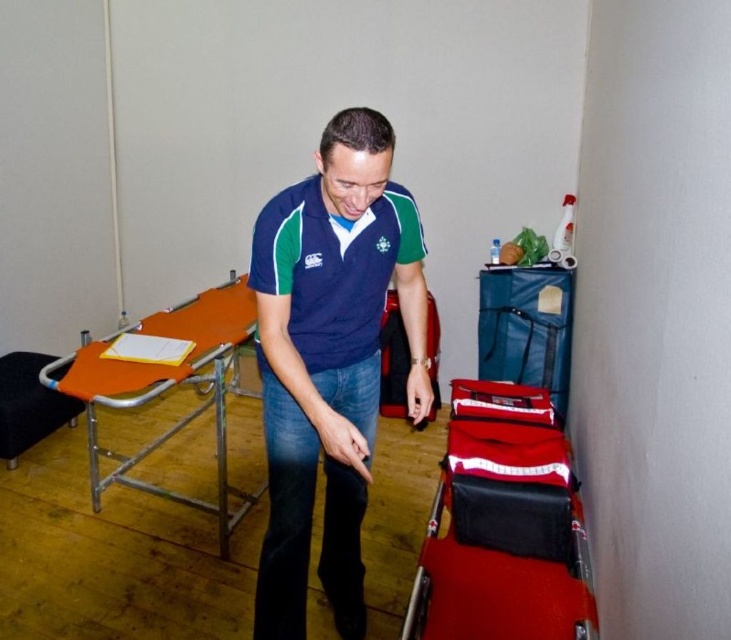
Who is lower down, navy blue jersey at center or red leather suitcase at lower right?

red leather suitcase at lower right is lower down.

The width and height of the screenshot is (731, 640). Describe the element at coordinates (333, 268) in the screenshot. I see `navy blue jersey at center` at that location.

Does point (281, 196) come closer to viewer compared to point (435, 332)?

Yes.

Find the location of a particular element. navy blue jersey at center is located at coordinates pyautogui.click(x=333, y=268).

Who is positioned more to the right, teal fabric suitcase at right or orange fabric stool at lower left?

From the viewer's perspective, teal fabric suitcase at right appears more on the right side.

Image resolution: width=731 pixels, height=640 pixels. In order to click on teal fabric suitcase at right in this screenshot , I will do `click(526, 326)`.

Can you confirm if red plastic cart at lower right is taller than red leather suitcase at lower right?

Incorrect, red plastic cart at lower right's height is not larger of red leather suitcase at lower right's.

Which is in front, point (534, 611) or point (385, 362)?

Point (534, 611) is more forward.

Find the location of `red plastic cart at lower right`. red plastic cart at lower right is located at coordinates (492, 593).